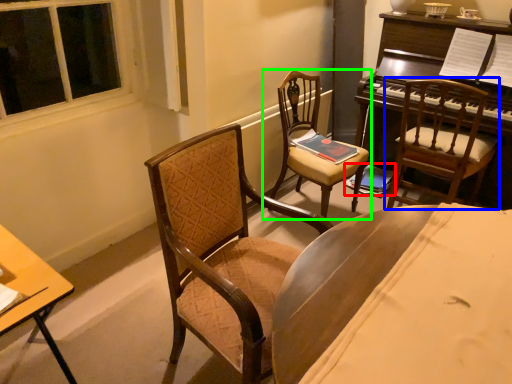
Question: Estimate the real-world distances between objects in this image. Which object is farther from book (highlighted by a red box), chair (highlighted by a blue box) or chair (highlighted by a green box)?

Choices:
 (A) chair
 (B) chair

Answer: (B)